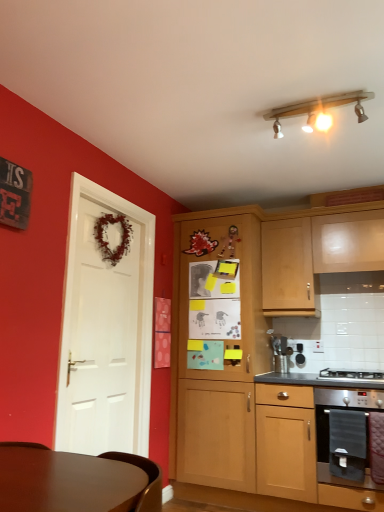
Where is `empty space that is ontop of wooden track light at upper center (from a real-world perspective)`? empty space that is ontop of wooden track light at upper center (from a real-world perspective) is located at coordinates (321, 96).